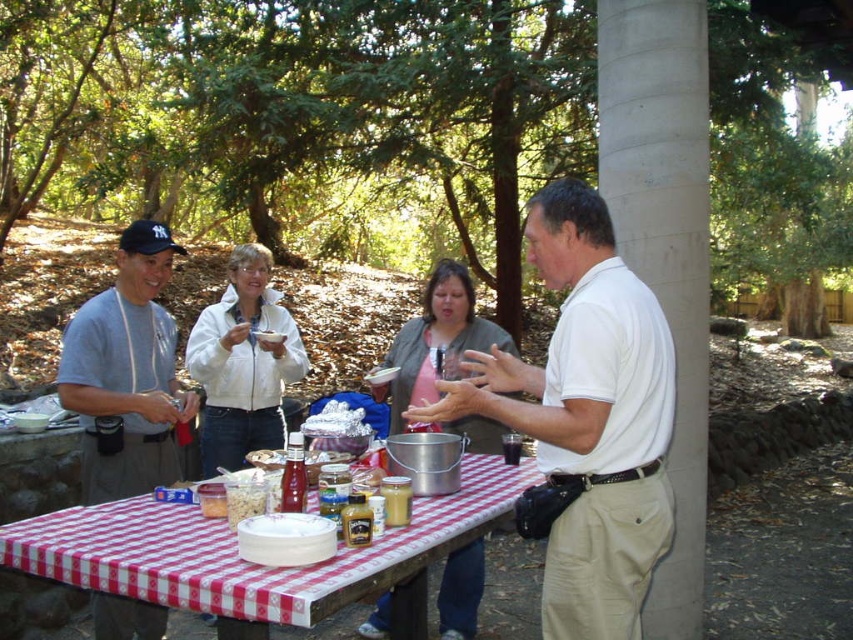
Question: Which point is closer to the camera taking this photo?

Choices:
 (A) (148, 577)
 (B) (109, 420)
 (C) (589, 560)

Answer: (A)

Question: Is checkered fabric table at center positioned at the back of gray cotton t-shirt at left?

Choices:
 (A) no
 (B) yes

Answer: (A)

Question: Can you confirm if gray cotton t-shirt at left is positioned to the left of white matte jacket at center?

Choices:
 (A) no
 (B) yes

Answer: (B)

Question: Observing the image, what is the correct spatial positioning of white cotton shirt at center in reference to pink fabric shirt at center?

Choices:
 (A) below
 (B) above

Answer: (B)

Question: Which of the following is the closest to the observer?

Choices:
 (A) pink fabric shirt at center
 (B) white cotton shirt at center
 (C) checkered fabric table at center

Answer: (C)

Question: Which point appears farthest from the camera in this image?

Choices:
 (A) (397, 348)
 (B) (77, 552)

Answer: (A)